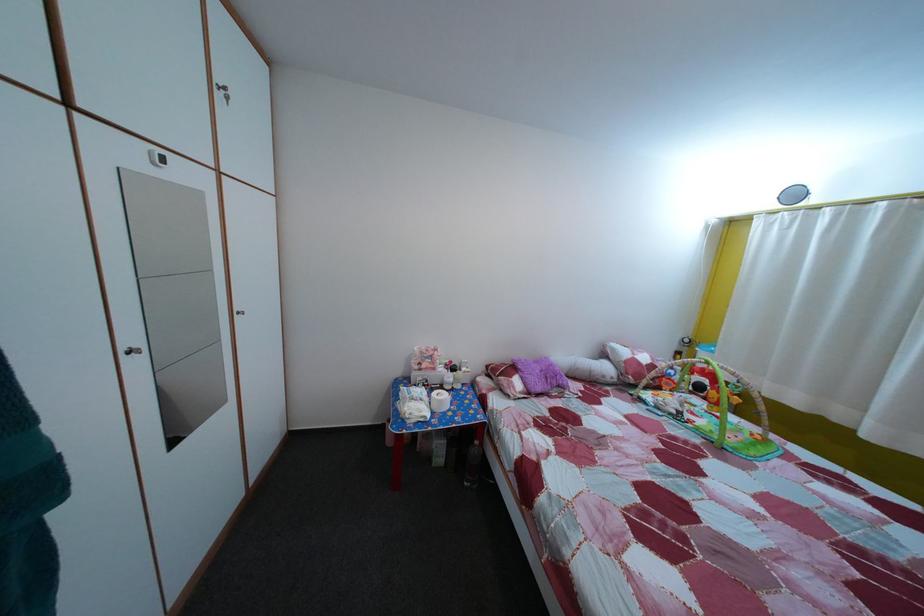
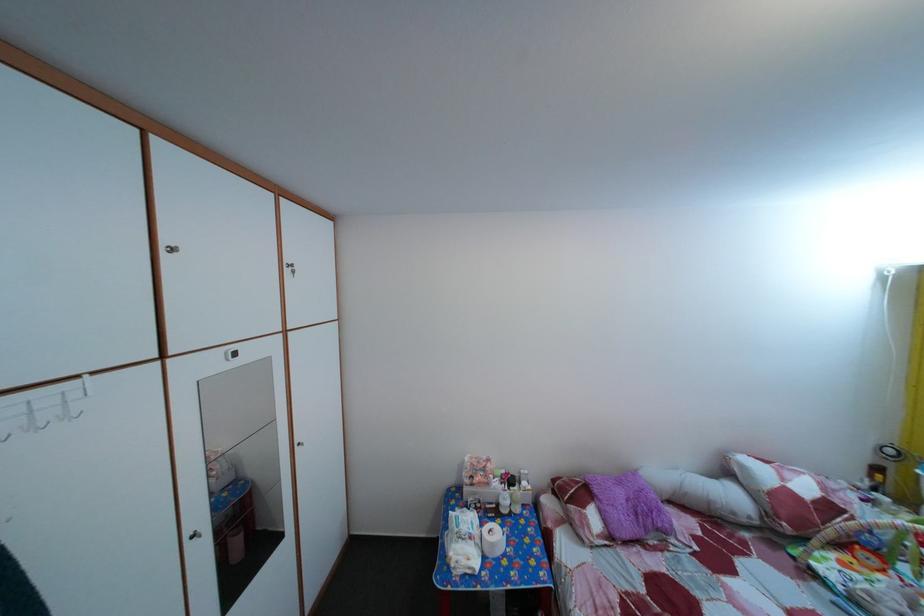
Find the pixel in the second image that matches the point at 450,408 in the first image.

(502, 553)